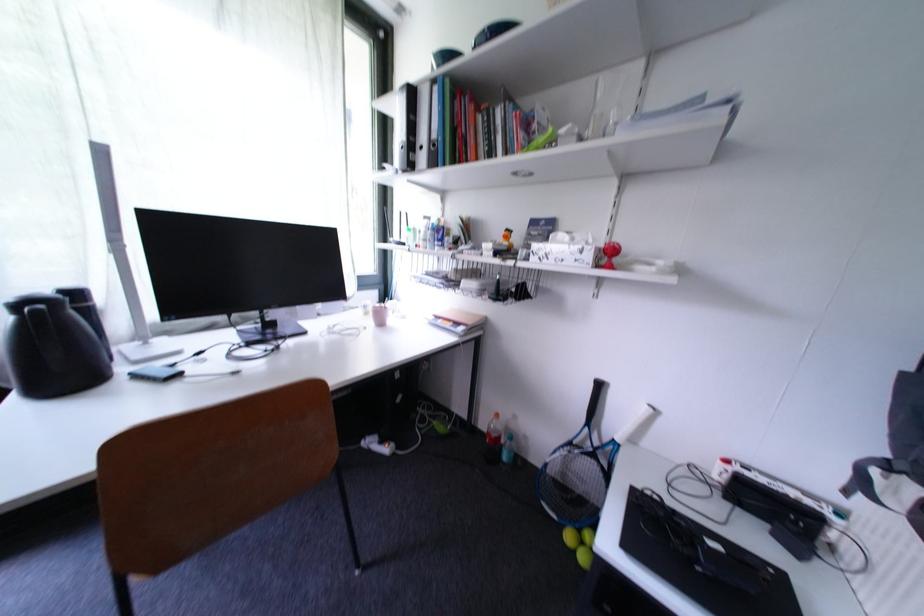
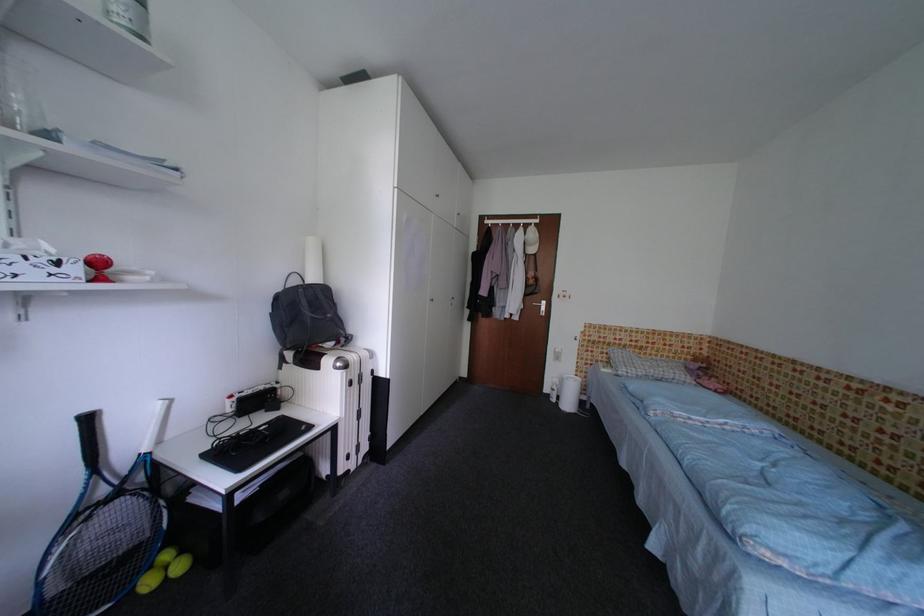
Locate, in the second image, the point that corresponds to the point at 652,411 in the first image.

(167, 408)